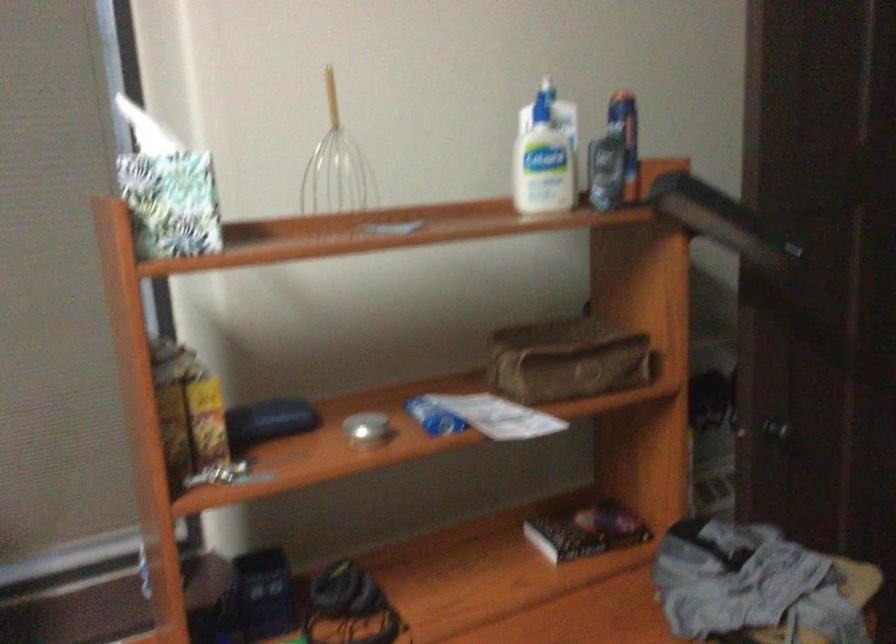
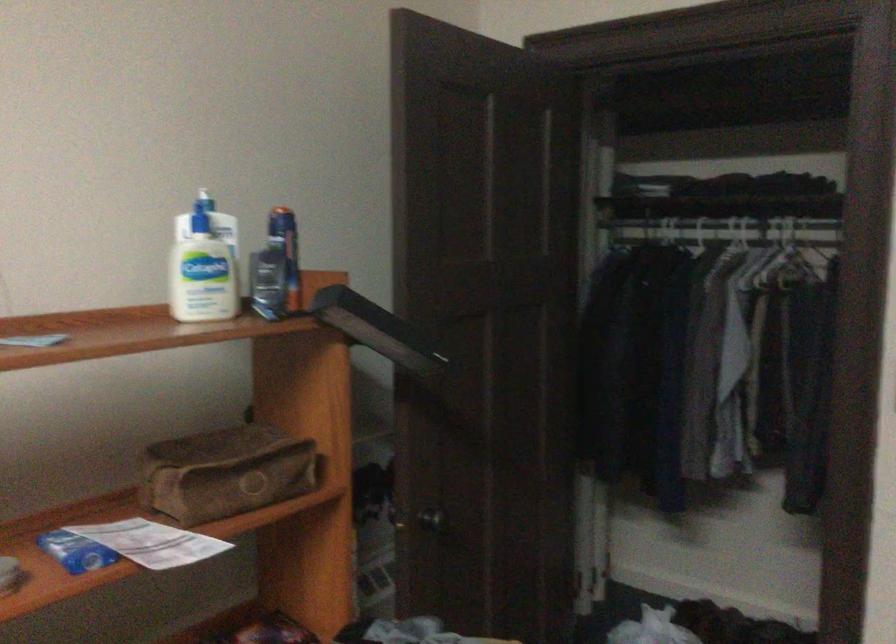
Question: The camera is either moving clockwise (left) or counter-clockwise (right) around the object. The first image is from the beginning of the video and the second image is from the end. Is the camera moving left or right when shooting the video?

Choices:
 (A) Left
 (B) Right

Answer: (A)